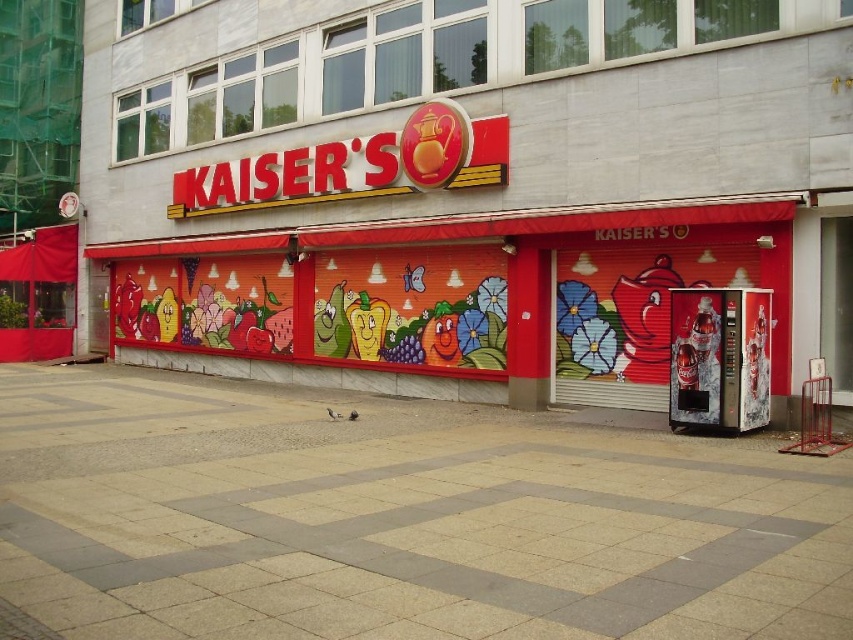
Question: Is matte red vending machine at center right in front of gray concrete pavement at center?

Choices:
 (A) no
 (B) yes

Answer: (A)

Question: Which point is farther to the camera?

Choices:
 (A) (236, 499)
 (B) (195, 77)

Answer: (B)

Question: Does matte red vending machine at center right come in front of gray concrete pavement at center?

Choices:
 (A) no
 (B) yes

Answer: (A)

Question: Is matte red vending machine at center right further to the viewer compared to gray concrete pavement at center?

Choices:
 (A) no
 (B) yes

Answer: (B)